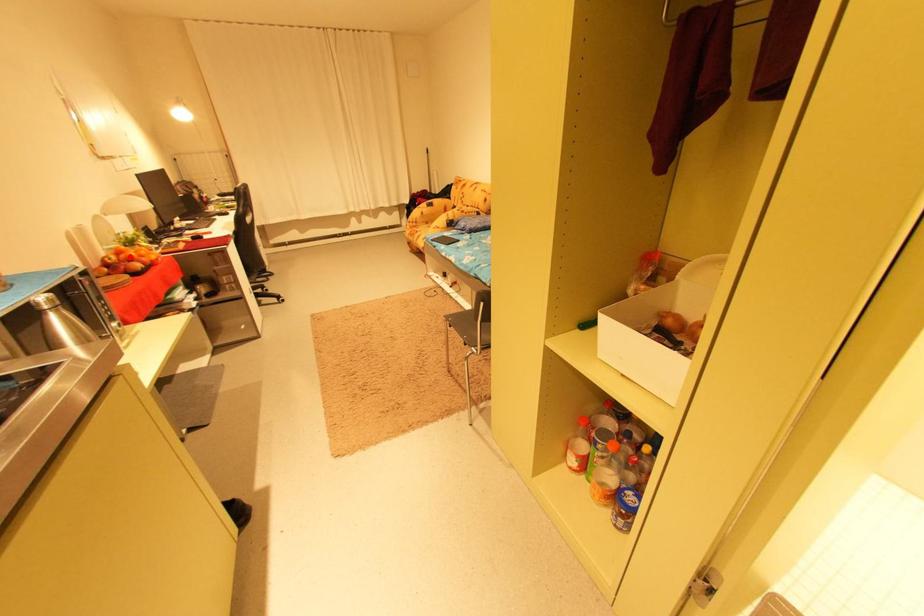
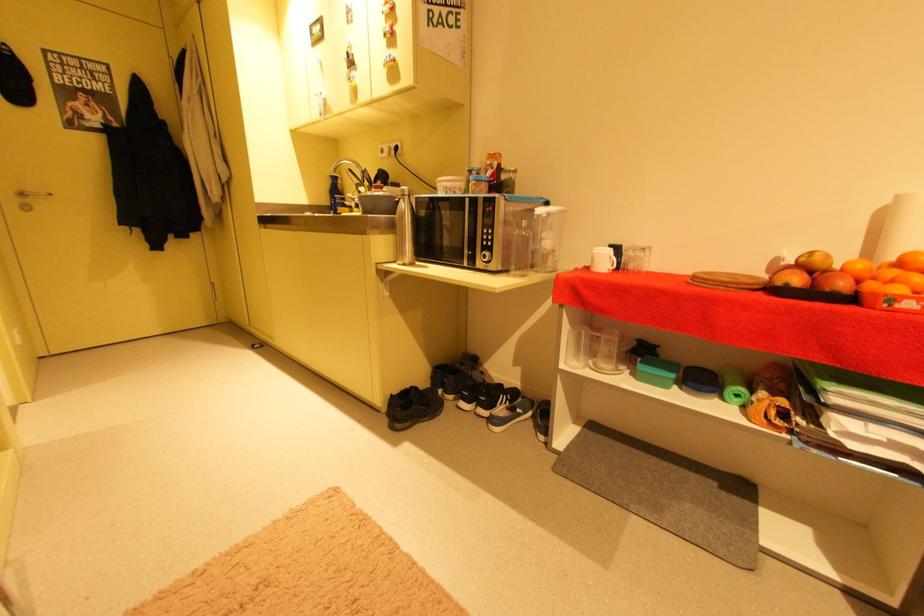
Question: I am providing you with two images of the same scene from different viewpoints. A red point is marked on the first image. Can you still see the location of the red point in image 2?

Choices:
 (A) Yes
 (B) No

Answer: (B)